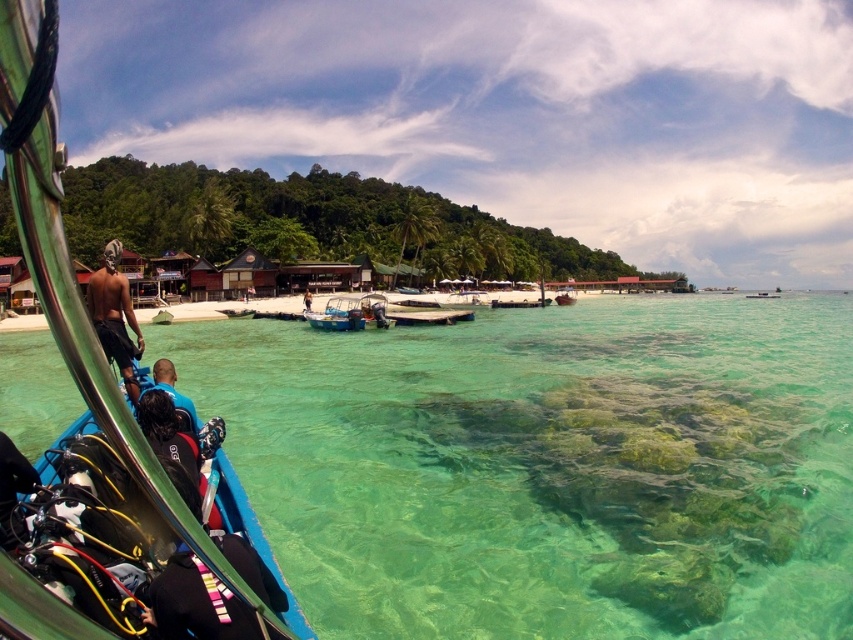
Between blue plastic boat at center and metallic blue boat at center, which one appears on the left side from the viewer's perspective?

blue plastic boat at center

Is point (387, 326) closer to camera compared to point (755, 296)?

Yes, it is.

Describe the element at coordinates (350, 312) in the screenshot. This screenshot has height=640, width=853. I see `blue plastic boat at center` at that location.

In order to click on blue plastic boat at center in this screenshot , I will do `click(350, 312)`.

Who is positioned more to the right, blue plastic boat at center or blue fabric shirt at center?

blue plastic boat at center

Does blue plastic boat at center lie behind blue fabric shirt at center?

No, it is in front of blue fabric shirt at center.

Who is more distant from viewer, (x=351, y=326) or (x=309, y=292)?

The point (x=309, y=292) is behind.

Find the location of `blue plastic boat at center`. blue plastic boat at center is located at coordinates (350, 312).

Measure the distance from blue plastic boat at center to blue fabric at lower left.

blue plastic boat at center and blue fabric at lower left are 29.95 meters apart from each other.

What do you see at coordinates (350, 312) in the screenshot? I see `blue plastic boat at center` at bounding box center [350, 312].

Where is `blue plastic boat at center`? blue plastic boat at center is located at coordinates (350, 312).

The width and height of the screenshot is (853, 640). In order to click on blue plastic boat at center in this screenshot , I will do `click(350, 312)`.